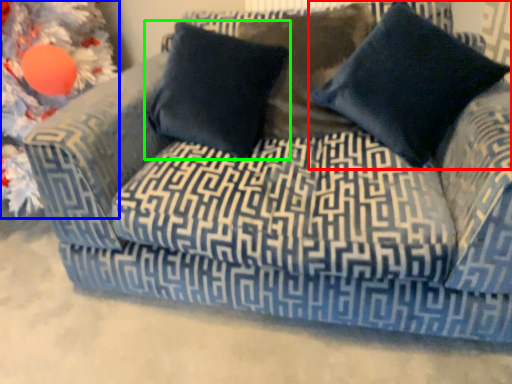
Question: Which is nearer to the pillow (highlighted by a red box)? christmas decoration (highlighted by a blue box) or pillow (highlighted by a green box).

Choices:
 (A) christmas decoration
 (B) pillow

Answer: (B)